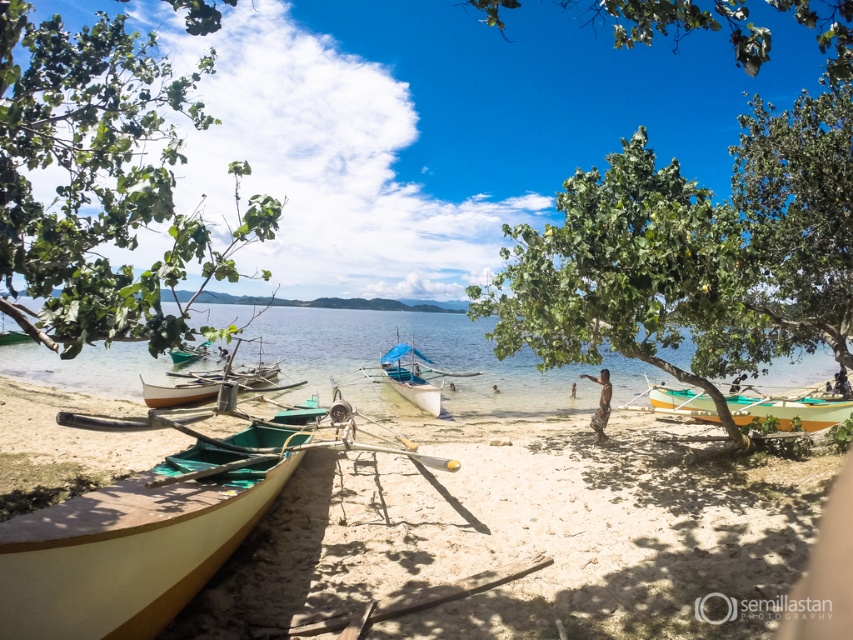
You are standing on the beach and want to find shade. You see the green leafy tree at left and the green leafy tree at upper center. Which tree would provide taller shade?

The green leafy tree at upper center is taller than the green leafy tree at left, so it would provide taller shade.